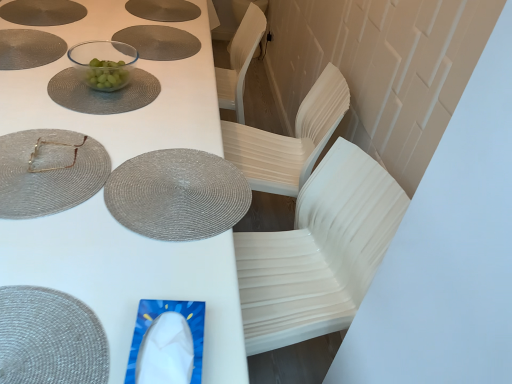
At what (x,y) coordinates should I click in order to perform the action: click on free space between matte gray placemat at upper left, the first plate from the left, and clear glass bowl at upper center, placed as the fourth tableware when sorted from bottom to top. Please return your answer as a coordinate pair (x, y). Looking at the image, I should click on (66, 62).